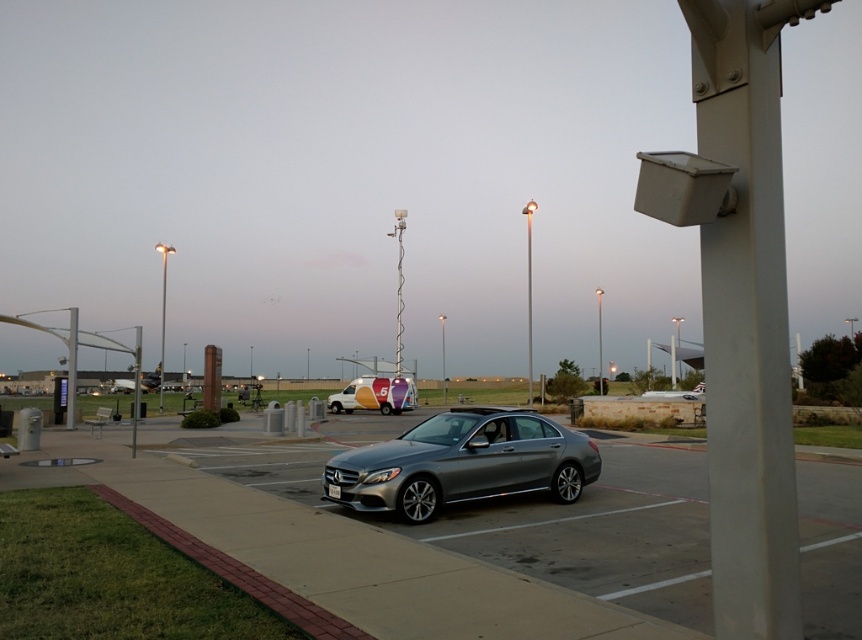
You are standing at the point marked by the coordinates point (461, 461) in the image. What object are you directly facing?

The point (461, 461) indicates the satin silver sedan at center, so you are directly facing the satin silver sedan at center.

You are a pedestrian standing at the entrance of the transportation hub. You see the satin silver sedan at center and the brushed metal pole at left. Which object is closer to you?

The satin silver sedan at center is closer to you because it is positioned in front of the brushed metal pole at left.